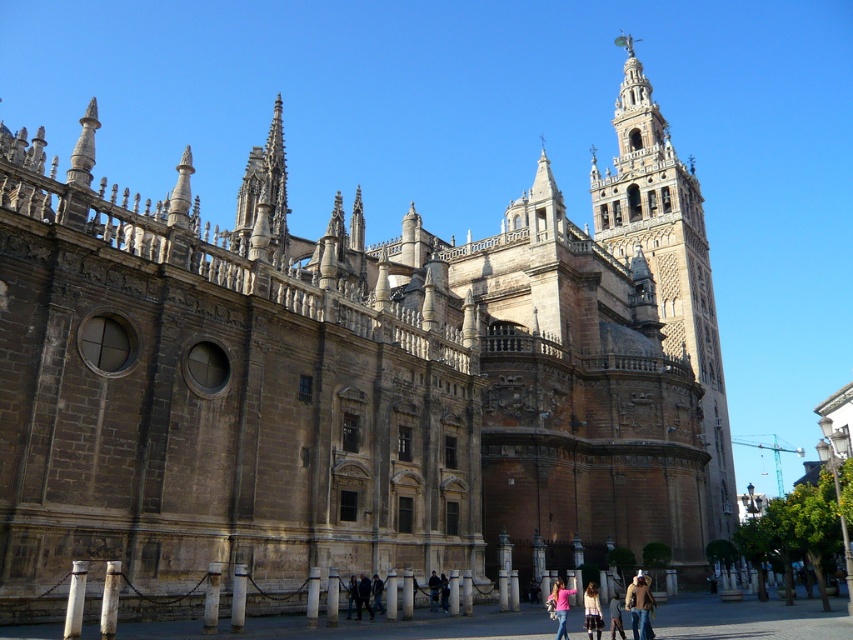
Question: Can you confirm if brown stone tower at upper right is positioned to the right of pink fabric at center?

Choices:
 (A) no
 (B) yes

Answer: (B)

Question: Which point is farther to the camera?

Choices:
 (A) dark blue jeans at center
 (B) denim jacket at lower right
 (C) brown stone tower at upper right

Answer: (C)

Question: Which object is closer to the camera taking this photo?

Choices:
 (A) light brown leather jacket at lower center
 (B) denim jacket at lower right
 (C) dark brown leather jacket at center

Answer: (B)

Question: Which is nearer to the brown stone tower at upper right?

Choices:
 (A) light brown leather jacket at lower center
 (B) denim jacket at lower right
 (C) pink fabric at center
 (D) dark blue jeans at center

Answer: (B)

Question: Is pink fabric at center above dark brown leather jacket at center?

Choices:
 (A) yes
 (B) no

Answer: (A)

Question: Is the position of brown stone tower at upper right more distant than that of light brown leather jacket at lower center?

Choices:
 (A) yes
 (B) no

Answer: (A)